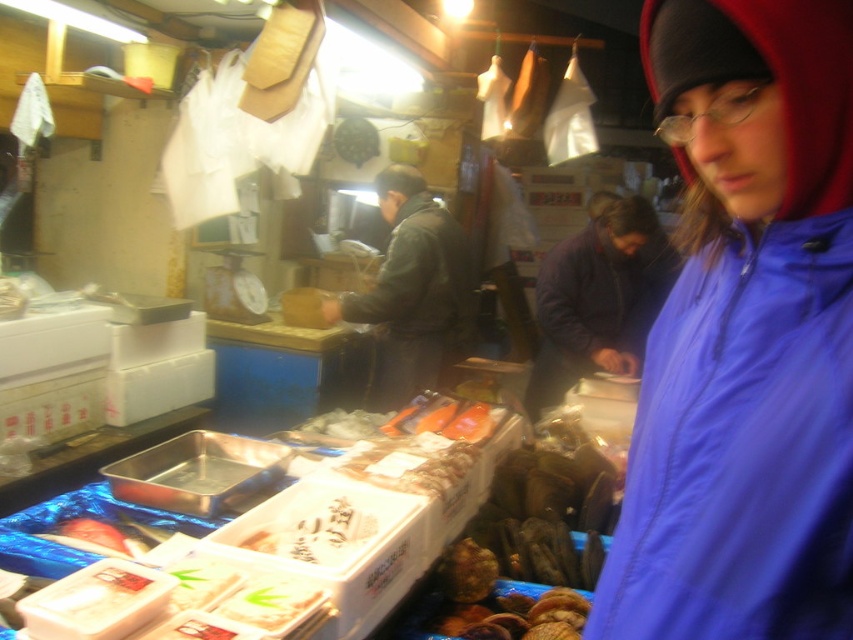
You are a customer at the fish market and want to locate the two points mentioned. Which point is closer to you, point [633,234] or point [456,253]?

Point [633,234] is in front of point [456,253], so it is closer to you.

You are a customer at the fish market and want to see the vendor clearly. Which jacket, the blue fabric jacket at center or the dark blue jacket at center, should you move aside to get a better view?

The blue fabric jacket at center is positioned under the dark blue jacket at center, so you should move the dark blue jacket at center to get a better view of the vendor.